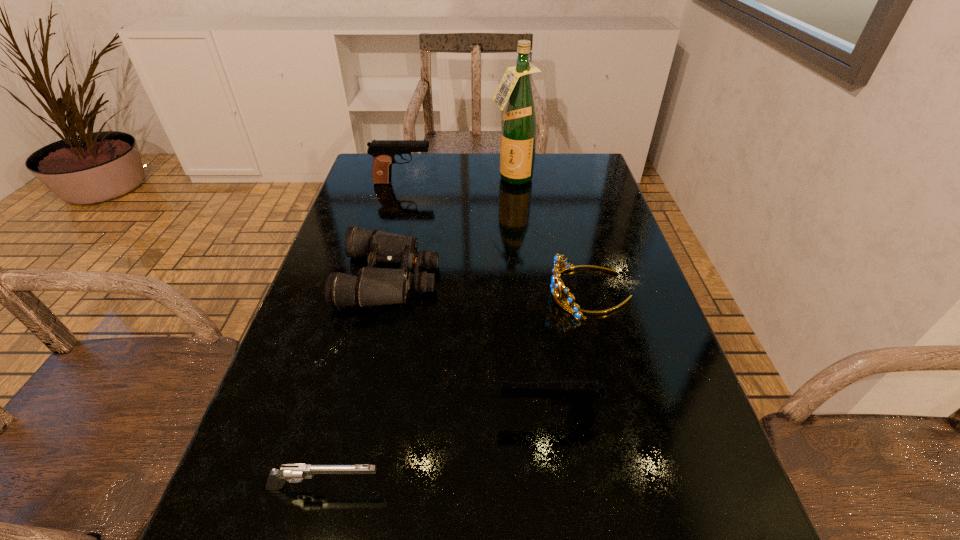
Locate an element on the screen. The height and width of the screenshot is (540, 960). pistol located in the far edge section of the desktop is located at coordinates click(x=383, y=151).

Image resolution: width=960 pixels, height=540 pixels. Identify the location of binoculars that is at the left edge. (374, 286).

The height and width of the screenshot is (540, 960). I want to click on object at the right edge, so click(555, 285).

This screenshot has width=960, height=540. I want to click on object located in the far left corner section of the desktop, so click(383, 151).

In the image, there is a desktop. At what (x,y) coordinates should I click in order to perform the action: click on free space at the far edge. Please return your answer as a coordinate pair (x, y). Looking at the image, I should click on (489, 164).

I want to click on vacant space at the left edge of the desktop, so click(336, 477).

In the image, there is a desktop. At what (x,y) coordinates should I click in order to perform the action: click on vacant space at the right edge. Please return your answer as a coordinate pair (x, y). The width and height of the screenshot is (960, 540). Looking at the image, I should click on (636, 449).

At what (x,y) coordinates should I click in order to perform the action: click on free space at the far left corner of the desktop. Please return your answer as a coordinate pair (x, y). This screenshot has width=960, height=540. Looking at the image, I should click on (356, 189).

Locate an element on the screen. Image resolution: width=960 pixels, height=540 pixels. empty location between the fifth farthest object and the tiara is located at coordinates (570, 354).

Find the location of `free space between the shortest pistol and the farthest pistol`. free space between the shortest pistol and the farthest pistol is located at coordinates (364, 335).